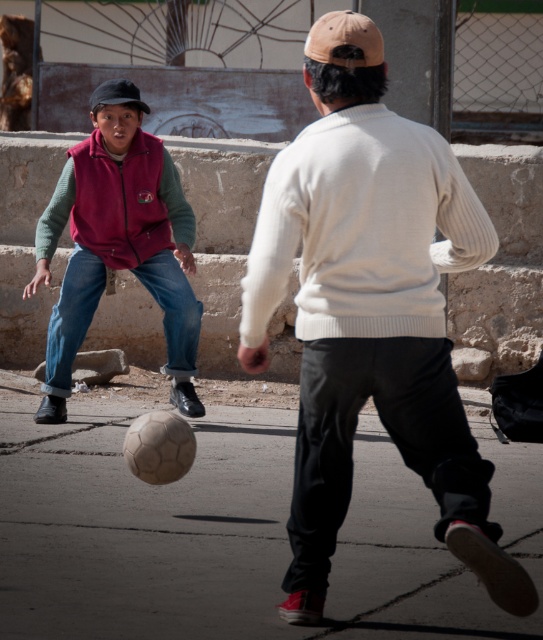
Question: Which point is closer to the camera?

Choices:
 (A) matte pink vest at left
 (B) matte red vest at left
 (C) white knit sweater at center

Answer: (C)

Question: Can you confirm if white knit sweater at center is wider than matte pink vest at left?

Choices:
 (A) yes
 (B) no

Answer: (A)

Question: Considering the real-world distances, which object is closest to the matte red vest at left?

Choices:
 (A) matte pink vest at left
 (B) white knit sweater at center

Answer: (A)

Question: Does white knit sweater at center have a greater width compared to matte red vest at left?

Choices:
 (A) no
 (B) yes

Answer: (A)

Question: Is white knit sweater at center to the right of matte pink vest at left from the viewer's perspective?

Choices:
 (A) no
 (B) yes

Answer: (B)

Question: Based on their relative distances, which object is nearer to the white knit sweater at center?

Choices:
 (A) matte pink vest at left
 (B) matte red vest at left

Answer: (B)